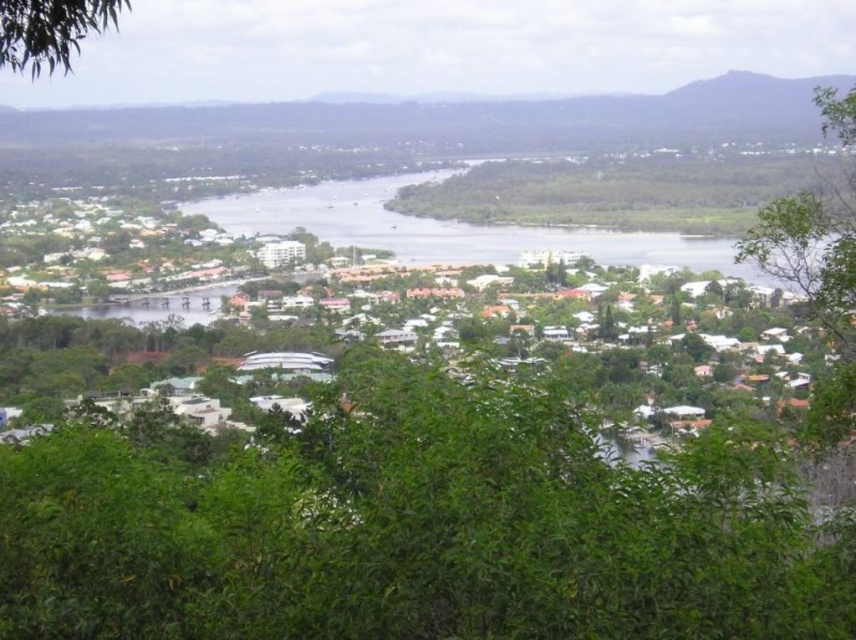
Question: Which point is farther to the camera?

Choices:
 (A) (765, 262)
 (B) (204, 552)
 (C) (33, 20)

Answer: (A)

Question: Which of the following is the closest to the observer?

Choices:
 (A) green leafy tree at upper left
 (B) green leafy tree at right
 (C) green leafy tree at center

Answer: (C)

Question: Is green leafy tree at center positioned at the back of green leafy tree at upper left?

Choices:
 (A) no
 (B) yes

Answer: (A)

Question: Which point appears closest to the camera in this image?

Choices:
 (A) (841, 227)
 (B) (70, 42)

Answer: (B)

Question: Can you confirm if green leafy tree at right is bigger than green leafy tree at upper left?

Choices:
 (A) yes
 (B) no

Answer: (A)

Question: Does green leafy tree at right have a smaller size compared to green leafy tree at upper left?

Choices:
 (A) no
 (B) yes

Answer: (A)